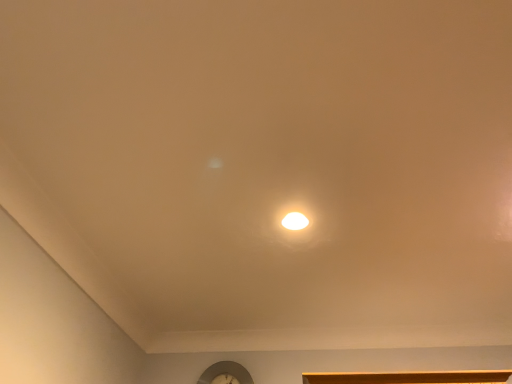
Question: Is the depth of metallic silver clock at lower center greater than that of white glossy light fixture at center?

Choices:
 (A) yes
 (B) no

Answer: (A)

Question: Is metallic silver clock at lower center bigger than white glossy light fixture at center?

Choices:
 (A) yes
 (B) no

Answer: (A)

Question: Does metallic silver clock at lower center have a greater height compared to white glossy light fixture at center?

Choices:
 (A) no
 (B) yes

Answer: (B)

Question: Can white glossy light fixture at center be found inside metallic silver clock at lower center?

Choices:
 (A) no
 (B) yes

Answer: (A)

Question: Does metallic silver clock at lower center have a lesser width compared to white glossy light fixture at center?

Choices:
 (A) no
 (B) yes

Answer: (B)

Question: Is the surface of metallic silver clock at lower center in direct contact with white glossy light fixture at center?

Choices:
 (A) yes
 (B) no

Answer: (B)

Question: Does white glossy light fixture at center have a larger size compared to metallic silver clock at lower center?

Choices:
 (A) no
 (B) yes

Answer: (A)

Question: Is metallic silver clock at lower center located within white glossy light fixture at center?

Choices:
 (A) yes
 (B) no

Answer: (B)

Question: Could you tell me if white glossy light fixture at center is facing metallic silver clock at lower center?

Choices:
 (A) no
 (B) yes

Answer: (A)

Question: Considering the relative positions of white glossy light fixture at center and metallic silver clock at lower center in the image provided, is white glossy light fixture at center to the right of metallic silver clock at lower center from the viewer's perspective?

Choices:
 (A) no
 (B) yes

Answer: (B)

Question: Is white glossy light fixture at center not within metallic silver clock at lower center?

Choices:
 (A) no
 (B) yes

Answer: (B)

Question: Is white glossy light fixture at center thinner than metallic silver clock at lower center?

Choices:
 (A) yes
 (B) no

Answer: (B)

Question: Is white glossy light fixture at center inside or outside of metallic silver clock at lower center?

Choices:
 (A) inside
 (B) outside

Answer: (B)